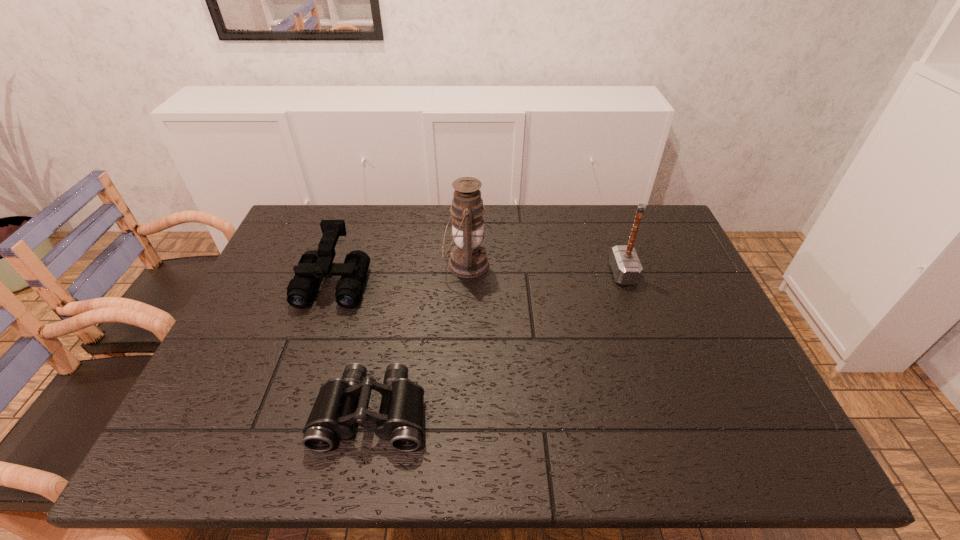
Where is `unoccupied area between the oil lamp and the rightmost object`? This screenshot has width=960, height=540. unoccupied area between the oil lamp and the rightmost object is located at coordinates (544, 269).

The height and width of the screenshot is (540, 960). In order to click on the second closest object to the oil lamp in this screenshot , I will do `click(340, 403)`.

Point out which object is positioned as the nearest to the second tallest object. Please provide its 2D coordinates. Your answer should be formatted as a tuple, i.e. [(x, y)], where the tuple contains the x and y coordinates of a point satisfying the conditions above.

[(468, 259)]

Find the location of a particular element. vacant position in the image that satisfies the following two spatial constraints: 1. on the striking surface of the rightmost object; 2. on the front-facing side of the shorter binoculars is located at coordinates [671, 412].

This screenshot has width=960, height=540. In order to click on free space that satisfies the following two spatial constraints: 1. on the striking surface of the hammer; 2. on the front-facing side of the nearest object in this screenshot , I will do `click(671, 412)`.

I want to click on free space that satisfies the following two spatial constraints: 1. on the striking surface of the second tallest object; 2. on the front-facing side of the nearest object, so click(x=671, y=412).